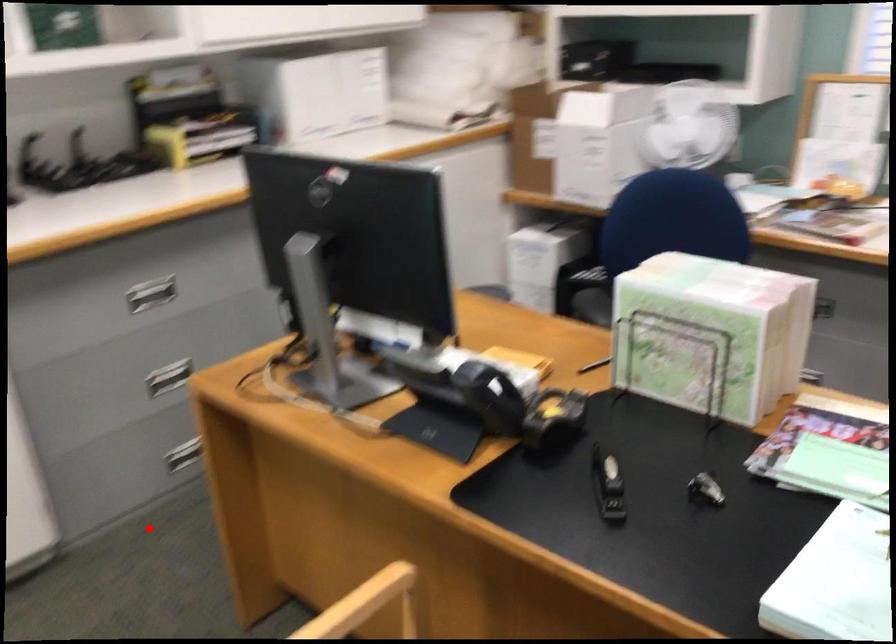
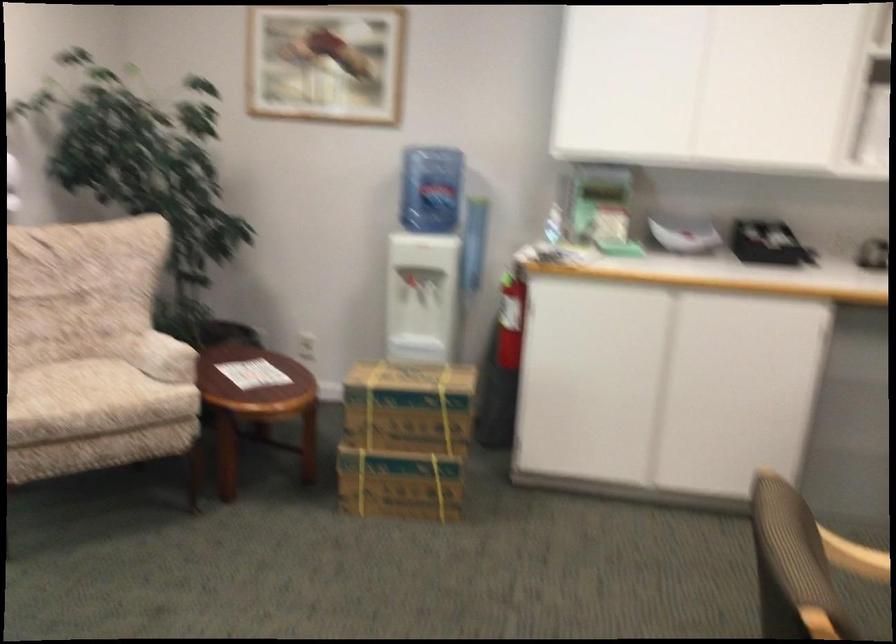
Question: I am providing you with two images of the same scene from different viewpoints. A red point is shown in image1. For the corresponding object point in image2, is it positioned nearer or farther from the camera?

Choices:
 (A) Nearer
 (B) Farther

Answer: (B)